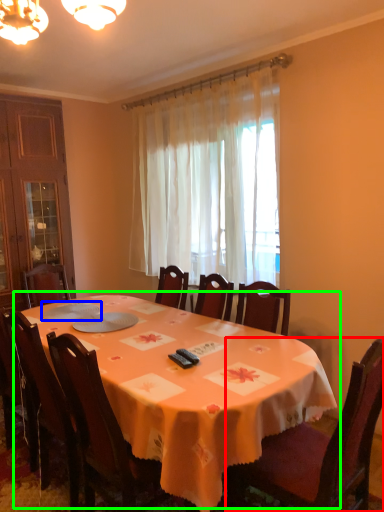
Question: Considering the real-world distances, which object is closest to chair (highlighted by a red box)? tableware (highlighted by a blue box) or table (highlighted by a green box).

Choices:
 (A) tableware
 (B) table

Answer: (B)